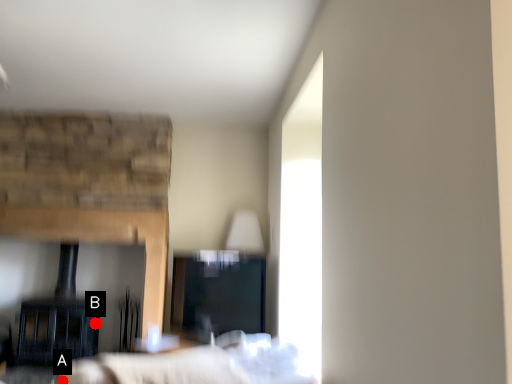
Question: Two points are circled on the image, labeled by A and B beside each circle. Which point appears closest to the camera in this image?

Choices:
 (A) A is closer
 (B) B is closer

Answer: (A)